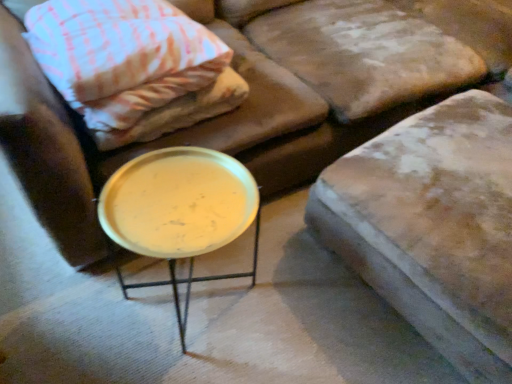
Question: Is pink woven fabric pillow at upper left to the left or to the right of metallic gold tray at center in the image?

Choices:
 (A) left
 (B) right

Answer: (A)

Question: From the image's perspective, is pink woven fabric pillow at upper left above or below metallic gold tray at center?

Choices:
 (A) below
 (B) above

Answer: (B)

Question: Which object is the farthest from the leather cushion at upper right?

Choices:
 (A) pink woven fabric pillow at upper left
 (B) metallic gold tray at center

Answer: (A)

Question: Considering the real-world distances, which object is farthest from the metallic gold tray at center?

Choices:
 (A) pink woven fabric pillow at upper left
 (B) leather cushion at upper right

Answer: (B)